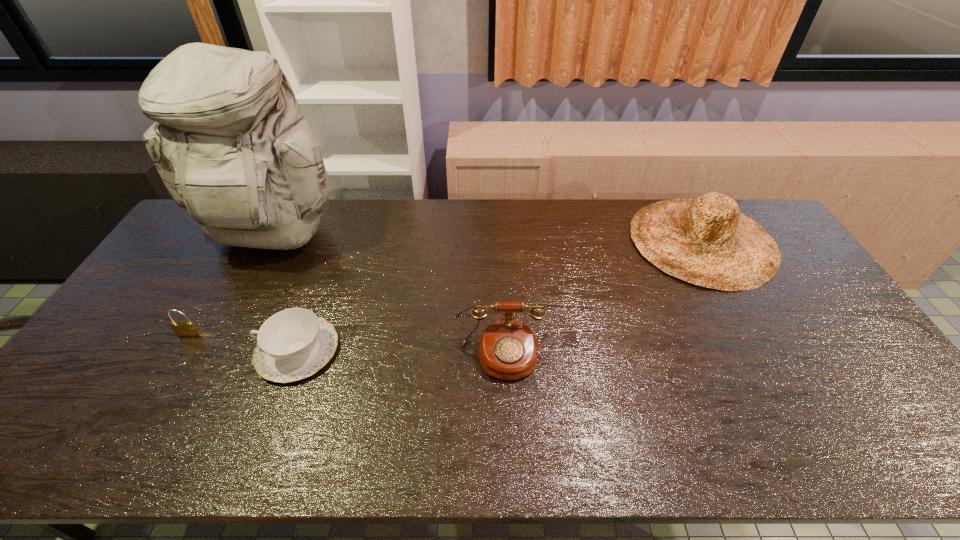
I want to click on vacant region between the telephone and the tallest object, so click(386, 296).

This screenshot has width=960, height=540. I want to click on empty space between the chinaware and the backpack, so click(285, 294).

Find the location of a particular element. free space between the rightmost object and the padlock is located at coordinates (445, 287).

You are a GUI agent. You are given a task and a screenshot of the screen. Output one action in this format:
    pyautogui.click(x=<x>, y=<y>)
    Task: Click on the object that stands as the closest to the shortest object
    
    Given the screenshot: What is the action you would take?
    pyautogui.click(x=184, y=328)

Find the location of a particular element. The image size is (960, 540). object that ranks as the third closest to the backpack is located at coordinates (508, 350).

The width and height of the screenshot is (960, 540). In order to click on free location that satisfies the following two spatial constraints: 1. on the front side of the rightmost object; 2. on the handle side of the chinaware in this screenshot , I will do `click(762, 350)`.

Locate an element on the screen. free space that satisfies the following two spatial constraints: 1. on the front-facing side of the sunhat; 2. on the left side of the tallest object is located at coordinates (271, 240).